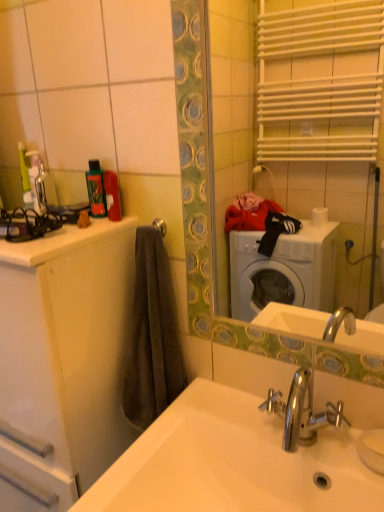
Question: Is white glossy mirror at upper center spatially inside green plastic bottle at upper left, or outside of it?

Choices:
 (A) inside
 (B) outside

Answer: (B)

Question: From a real-world perspective, is white glossy mirror at upper center positioned above or below green plastic bottle at upper left?

Choices:
 (A) below
 (B) above

Answer: (B)

Question: Which of these objects is positioned closest to the white glossy cabinet at left?

Choices:
 (A) green plastic bottle at upper left
 (B) white glossy mirror at upper center
 (C) white glossy sink at lower center

Answer: (C)

Question: Estimate the real-world distances between objects in this image. Which object is closer to the white glossy mirror at upper center?

Choices:
 (A) white glossy cabinet at left
 (B) white glossy sink at lower center
 (C) green plastic bottle at upper left

Answer: (A)